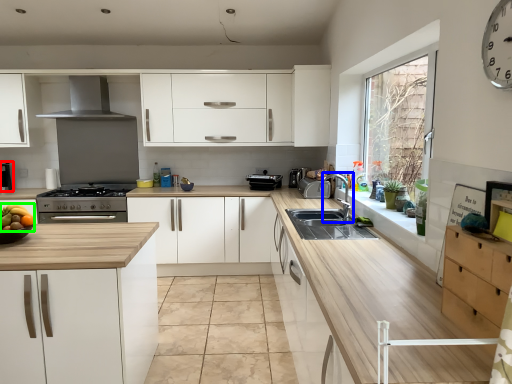
Question: Which object is positioned closest to coffee machine (highlighted by a red box)? Select from tap (highlighted by a blue box) and fruit (highlighted by a green box).

Choices:
 (A) tap
 (B) fruit

Answer: (B)